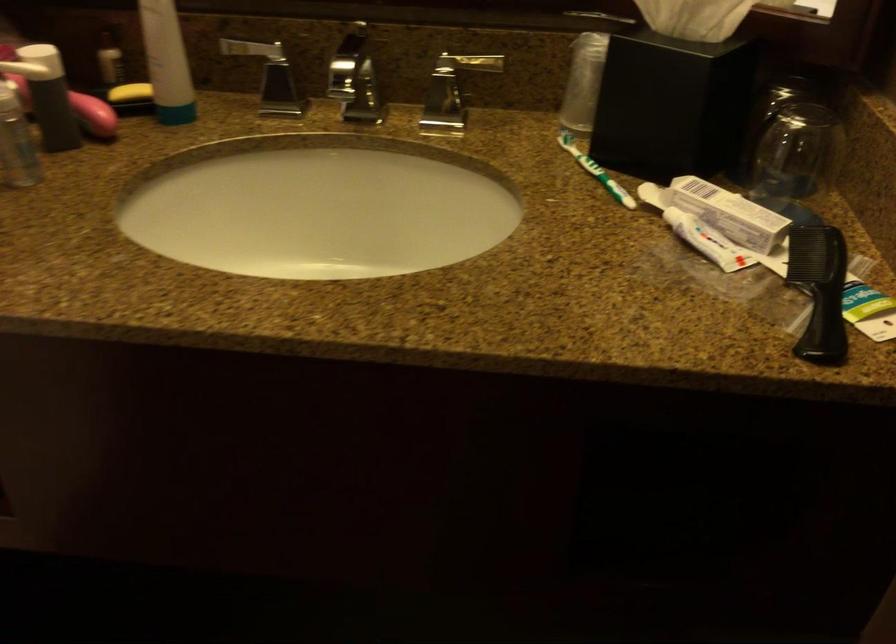
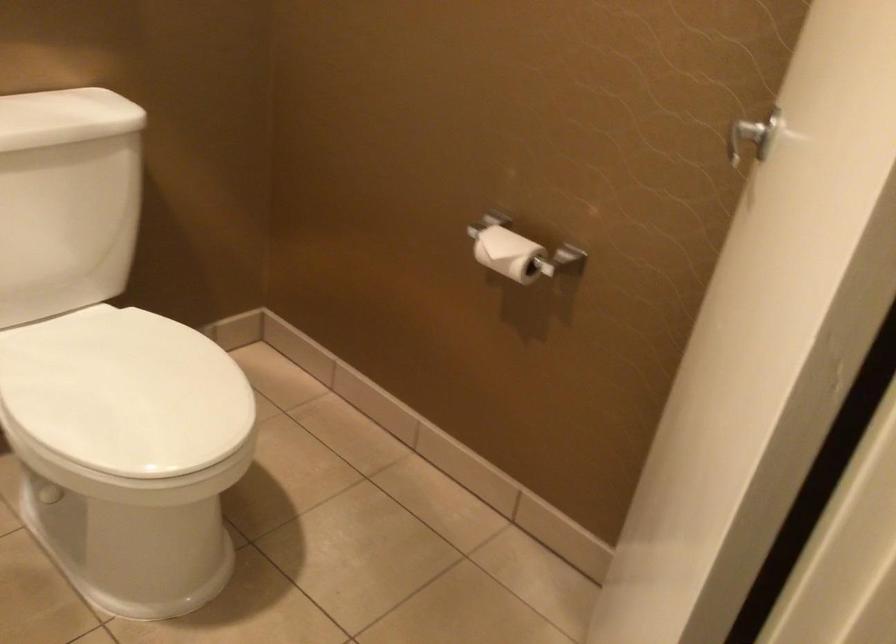
Question: The camera is either moving clockwise (left) or counter-clockwise (right) around the object. The first image is from the beginning of the video and the second image is from the end. Is the camera moving left or right when shooting the video?

Choices:
 (A) Left
 (B) Right

Answer: (B)